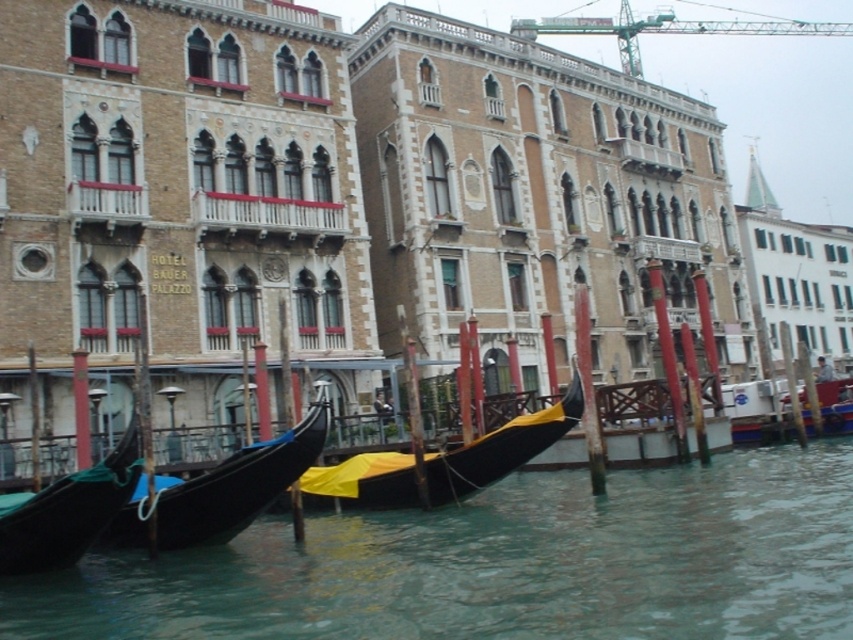
Based on the photo, between black glossy gondola at left and green metallic crane at upper center, which one appears on the left side from the viewer's perspective?

black glossy gondola at left is more to the left.

Consider the image. Does black glossy gondola at left have a greater height compared to green metallic crane at upper center?

In fact, black glossy gondola at left may be shorter than green metallic crane at upper center.

This screenshot has height=640, width=853. I want to click on black glossy gondola at left, so click(x=67, y=509).

Locate an element on the screen. This screenshot has width=853, height=640. black glossy gondola at left is located at coordinates (67, 509).

Find the location of a particular element. clear water at lower center is located at coordinates (502, 564).

Is point (408, 586) positioned after point (311, 493)?

That is False.

Describe the element at coordinates (502, 564) in the screenshot. I see `clear water at lower center` at that location.

Where is `clear water at lower center`? clear water at lower center is located at coordinates [x=502, y=564].

Can you confirm if black matte gondola at center is positioned to the right of green metallic crane at upper center?

Incorrect, black matte gondola at center is not on the right side of green metallic crane at upper center.

Does point (378, 477) lie behind point (711, 33)?

No, (378, 477) is in front of (711, 33).

This screenshot has height=640, width=853. I want to click on black matte gondola at center, so click(x=498, y=449).

At what (x,y) coordinates should I click in order to perform the action: click on black matte gondola at center. Please return your answer as a coordinate pair (x, y). Looking at the image, I should click on (498, 449).